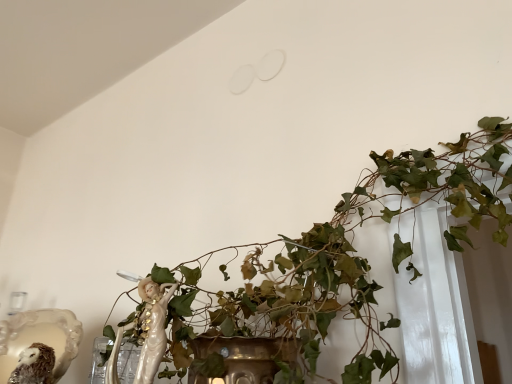
Question: From a real-world perspective, is fuzzy brown owl at lower left positioned over green leafy plant at center based on gravity?

Choices:
 (A) yes
 (B) no

Answer: (B)

Question: Could you tell me if fuzzy brown owl at lower left is turned towards green leafy plant at center?

Choices:
 (A) no
 (B) yes

Answer: (A)

Question: From a real-world perspective, is fuzzy brown owl at lower left below green leafy plant at center?

Choices:
 (A) no
 (B) yes

Answer: (B)

Question: Can you confirm if fuzzy brown owl at lower left is smaller than green leafy plant at center?

Choices:
 (A) yes
 (B) no

Answer: (A)

Question: Does fuzzy brown owl at lower left appear on the left side of green leafy plant at center?

Choices:
 (A) yes
 (B) no

Answer: (A)

Question: Does fuzzy brown owl at lower left have a larger size compared to green leafy plant at center?

Choices:
 (A) no
 (B) yes

Answer: (A)

Question: Is green leafy plant at center bigger than fuzzy brown owl at lower left?

Choices:
 (A) no
 (B) yes

Answer: (B)

Question: From the image's perspective, is green leafy plant at center located beneath fuzzy brown owl at lower left?

Choices:
 (A) yes
 (B) no

Answer: (B)

Question: Does green leafy plant at center contain fuzzy brown owl at lower left?

Choices:
 (A) yes
 (B) no

Answer: (B)

Question: Would you consider green leafy plant at center to be distant from fuzzy brown owl at lower left?

Choices:
 (A) yes
 (B) no

Answer: (B)

Question: Considering the relative positions of green leafy plant at center and fuzzy brown owl at lower left in the image provided, is green leafy plant at center to the left of fuzzy brown owl at lower left from the viewer's perspective?

Choices:
 (A) no
 (B) yes

Answer: (A)

Question: Can you confirm if green leafy plant at center is positioned to the right of fuzzy brown owl at lower left?

Choices:
 (A) no
 (B) yes

Answer: (B)

Question: Choose the correct answer: Is green leafy plant at center inside fuzzy brown owl at lower left or outside it?

Choices:
 (A) inside
 (B) outside

Answer: (B)